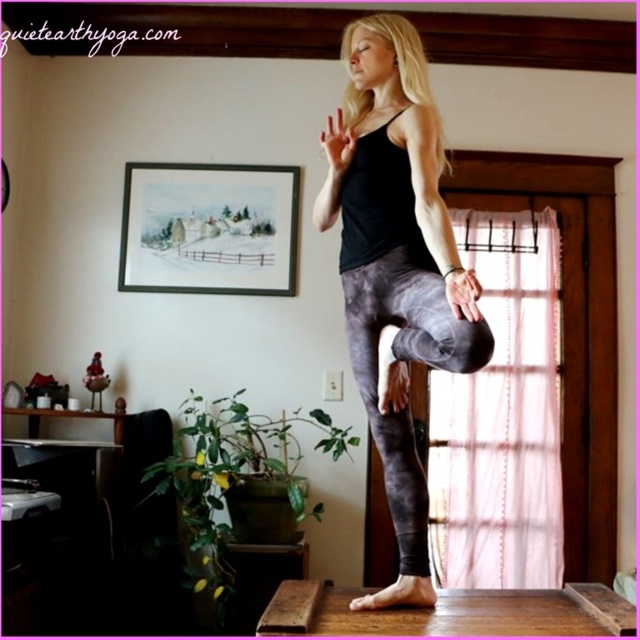
Question: Is black matte tank top at center positioned behind gray marbled leggings at center?

Choices:
 (A) yes
 (B) no

Answer: (B)

Question: Is black matte tank top at center below gray marbled leggings at center?

Choices:
 (A) yes
 (B) no

Answer: (B)

Question: Which of the following is the closest to the observer?

Choices:
 (A) (467, 355)
 (B) (419, 273)

Answer: (A)

Question: Can you confirm if black matte tank top at center is smaller than gray marbled leggings at center?

Choices:
 (A) no
 (B) yes

Answer: (A)

Question: Which point is farther from the camera taking this photo?

Choices:
 (A) (390, 428)
 (B) (388, 77)

Answer: (B)